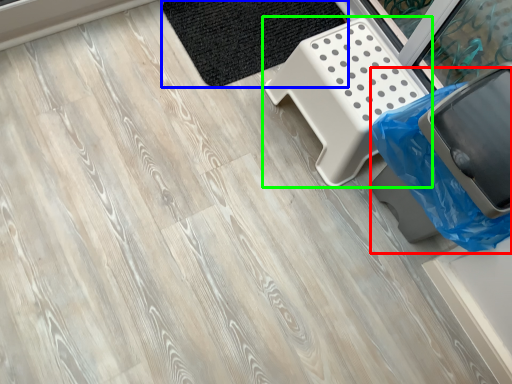
Question: Based on their relative distances, which object is nearer to garbage (highlighted by a red box)? Choose from mat (highlighted by a blue box) and furniture (highlighted by a green box).

Choices:
 (A) mat
 (B) furniture

Answer: (B)